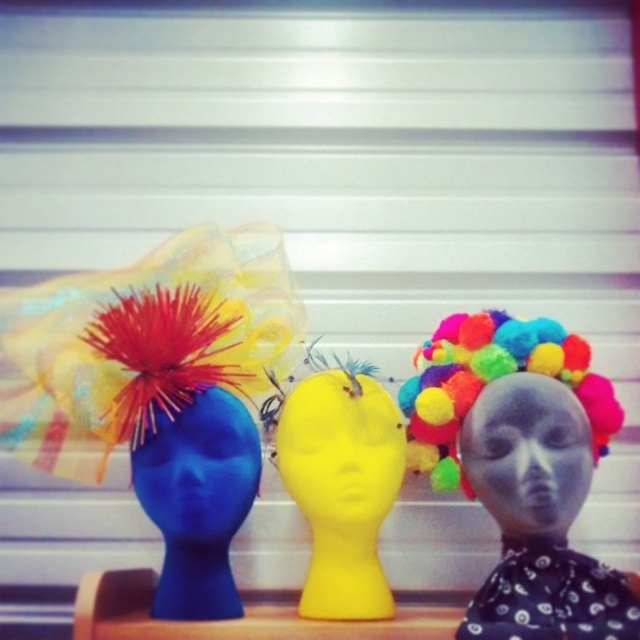
Who is lower down, yellow matte head at center or blue matte head at center?

blue matte head at center is below.

Between yellow matte head at center and blue matte head at center, which one has less height?

With less height is blue matte head at center.

Who is more forward, (392, 476) or (240, 499)?

Point (240, 499) is more forward.

At what (x,y) coordinates should I click in order to perform the action: click on yellow matte head at center. Please return your answer as a coordinate pair (x, y). This screenshot has width=640, height=640. Looking at the image, I should click on (340, 451).

Which is behind, point (548, 468) or point (545, 451)?

The point (545, 451) is more distant.

Is multicolored fabric wig at center taller than matte gray mask at center?

Yes.

The image size is (640, 640). Find the location of `multicolored fabric wig at center`. multicolored fabric wig at center is located at coordinates (522, 467).

Does yellow matte head at center have a smaller size compared to wooden at center?

Yes.

The height and width of the screenshot is (640, 640). What do you see at coordinates (340, 451) in the screenshot? I see `yellow matte head at center` at bounding box center [340, 451].

Identify the location of yellow matte head at center. The width and height of the screenshot is (640, 640). coord(340,451).